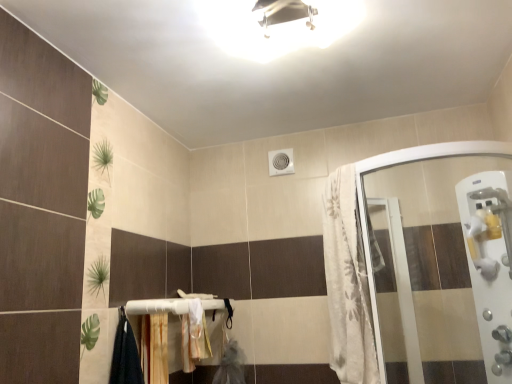
Question: From a real-world perspective, relative to wooden at lower center, is white glossy light fixture at upper center vertically above or below?

Choices:
 (A) below
 (B) above

Answer: (B)

Question: Do you think white glossy light fixture at upper center is within wooden at lower center, or outside of it?

Choices:
 (A) inside
 (B) outside

Answer: (B)

Question: Estimate the real-world distances between objects in this image. Which object is closer to the white fabric bath towel at lower center?

Choices:
 (A) white textured fabric at right
 (B) white glossy light fixture at upper center
 (C) white plastic handle at right
 (D) wooden at lower center

Answer: (D)

Question: Estimate the real-world distances between objects in this image. Which object is closer to the white fabric bath towel at lower center?

Choices:
 (A) white textured fabric at right
 (B) white plastic handle at right
 (C) wooden at lower center
 (D) white glossy light fixture at upper center

Answer: (C)